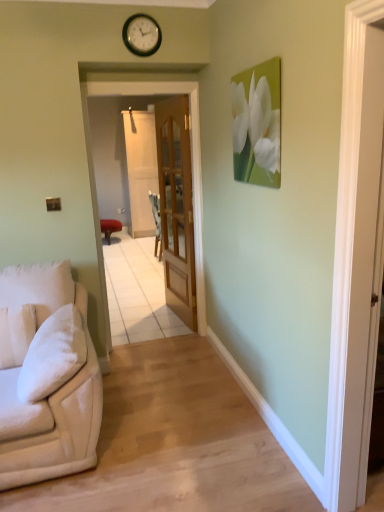
The width and height of the screenshot is (384, 512). Identify the location of vacant area situated below clear glass door at center, which is the second screen door from back to front (from a real-world perspective). (160, 341).